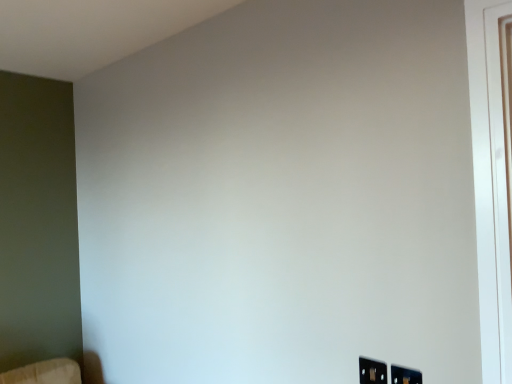
Question: Considering the positions of black plastic electric outlet at lower right, placed as the first electric outlet when sorted from left to right, and black plastic electric outlet at lower right, the 1th electric outlet in the right-to-left sequence, in the image, is black plastic electric outlet at lower right, placed as the first electric outlet when sorted from left to right, taller or shorter than black plastic electric outlet at lower right, the 1th electric outlet in the right-to-left sequence,?

Choices:
 (A) short
 (B) tall

Answer: (A)

Question: From the image's perspective, is black plastic electric outlet at lower right, placed as the first electric outlet when sorted from left to right, located above or below black plastic electric outlet at lower right, the 1th electric outlet positioned from the front?

Choices:
 (A) below
 (B) above

Answer: (B)

Question: From a real-world perspective, is black plastic electric outlet at lower right, placed as the first electric outlet when sorted from left to right, above or below black plastic electric outlet at lower right, arranged as the 2th electric outlet when viewed from the left?

Choices:
 (A) above
 (B) below

Answer: (A)

Question: From a real-world perspective, is black plastic electric outlet at lower right, the 1th electric outlet positioned from the front, positioned above or below black plastic electric outlet at lower right, the first electric outlet positioned from the back?

Choices:
 (A) below
 (B) above

Answer: (A)

Question: From the image's perspective, is black plastic electric outlet at lower right, arranged as the 2th electric outlet when viewed from the back, positioned above or below black plastic electric outlet at lower right, acting as the second electric outlet starting from the front?

Choices:
 (A) above
 (B) below

Answer: (B)

Question: Considering the positions of point (412, 372) and point (369, 369), is point (412, 372) closer or farther from the camera than point (369, 369)?

Choices:
 (A) closer
 (B) farther

Answer: (A)

Question: Considering the positions of black plastic electric outlet at lower right, arranged as the 2th electric outlet when viewed from the back, and black plastic electric outlet at lower right, placed as the first electric outlet when sorted from left to right, in the image, is black plastic electric outlet at lower right, arranged as the 2th electric outlet when viewed from the back, wider or thinner than black plastic electric outlet at lower right, placed as the first electric outlet when sorted from left to right,?

Choices:
 (A) thin
 (B) wide

Answer: (B)